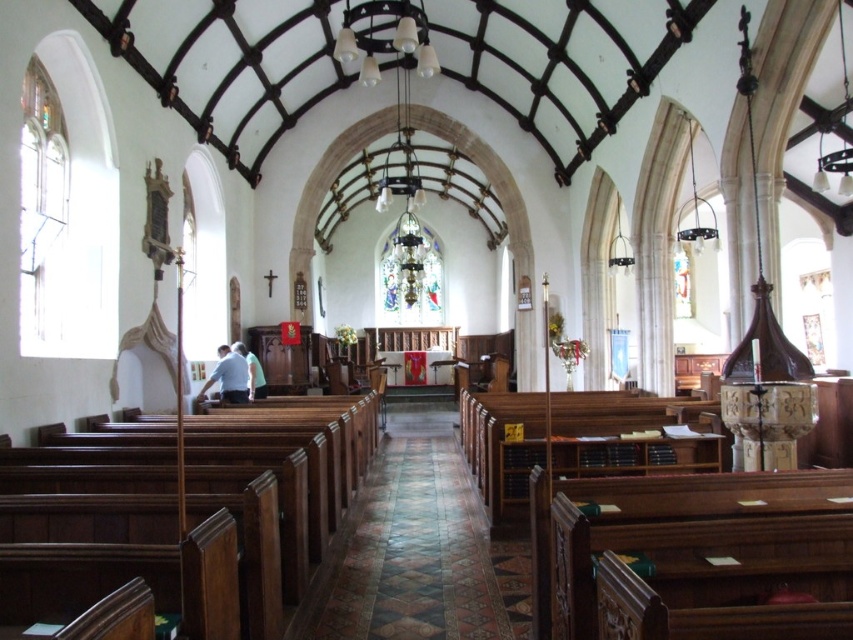
You are standing at the entrance of the church and want to walk towards the carpeted wooden aisle at center. In which direction should you move relative to your current position?

Since the carpeted wooden aisle at center is located at point 0.859 on the x axis and 0.490 on the y axis, you should move forward towards the center of the church to reach it.

You are a photographer standing in the center of the church. You want to take a photo that includes both the white shirt at center and the light blue fabric at center. What is the minimum distance you need to move backward to ensure both objects are fully in frame?

The white shirt at center and light blue fabric at center are 7.10 feet apart from each other. To capture both in the frame, you need to move back at least 7.10 feet to ensure the entire distance between them fits within the camera view.

You are standing at the entrance of the church and looking towards the altar. There are two points marked in the image, point 1 at coordinates point (439, 502) and point 2 at coordinates point (247, 349). Which point is closer to you?

Point (439, 502) is closer to the camera than point (247, 349), so point 1 is closer to you.